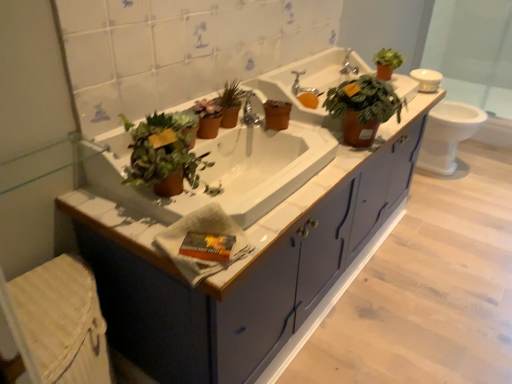
Find the location of a particular element. vacant area in front of matte blue cabinet at center is located at coordinates (374, 332).